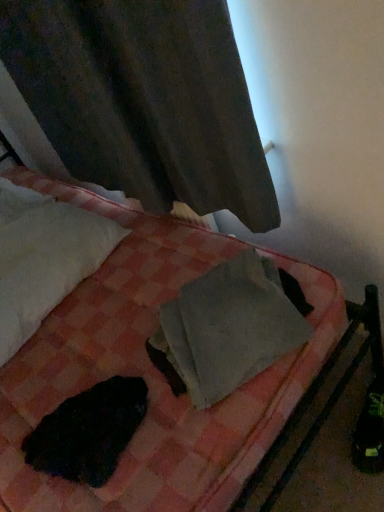
This screenshot has height=512, width=384. What do you see at coordinates (144, 100) in the screenshot? I see `matte gray curtain at upper left` at bounding box center [144, 100].

At what (x,y) coordinates should I click in order to perform the action: click on black fur at lower left. Please return your answer as a coordinate pair (x, y). This screenshot has height=512, width=384. Looking at the image, I should click on (88, 432).

In order to face white soft pillow at upper left, should I rotate leftwards or rightwards?

It's best to rotate left around 22.054 degrees.

The height and width of the screenshot is (512, 384). I want to click on pink checkered blanket at center, so click(158, 372).

Looking at this image, measure the distance between pink checkered blanket at center and camera.

pink checkered blanket at center is 32.79 inches away from camera.

This screenshot has height=512, width=384. What are the coordinates of `matte gray curtain at upper left` in the screenshot? It's located at (144, 100).

From the image's perspective, which is above, matte gray curtain at upper left or gray matte paper at center?

From the image's view, matte gray curtain at upper left is above.

Does matte gray curtain at upper left have a lesser width compared to gray matte paper at center?

Yes, matte gray curtain at upper left is thinner than gray matte paper at center.

From a real-world perspective, between matte gray curtain at upper left and gray matte paper at center, who is vertically higher?

matte gray curtain at upper left.

Relative to gray matte paper at center, is matte gray curtain at upper left in front or behind?

Clearly, matte gray curtain at upper left is in front of gray matte paper at center.

Can you confirm if black fur at lower left is smaller than pink checkered blanket at center?

Yes, black fur at lower left is smaller than pink checkered blanket at center.

From a real-world perspective, is black fur at lower left physically above pink checkered blanket at center?

No, from a real-world perspective, black fur at lower left is not over pink checkered blanket at center

Is the depth of black fur at lower left less than that of pink checkered blanket at center?

No, it is behind pink checkered blanket at center.

Which is behind, point (35, 470) or point (19, 385)?

Positioned behind is point (19, 385).

Which point is more distant from viewer, [215,398] or [29,496]?

Positioned behind is point [215,398].

Is pink checkered blanket at center located within gray matte paper at center?

No, pink checkered blanket at center is not a part of gray matte paper at center.

From a real-world perspective, is gray matte paper at center over pink checkered blanket at center?

No, from a real-world perspective, gray matte paper at center is not over pink checkered blanket at center

Which of these two, gray matte paper at center or pink checkered blanket at center, is smaller?

gray matte paper at center.

Who is shorter, gray matte paper at center or matte gray curtain at upper left?

Standing shorter between the two is gray matte paper at center.

Consider the image. From a real-world perspective, is gray matte paper at center located higher than matte gray curtain at upper left?

No, from a real-world perspective, gray matte paper at center is not over matte gray curtain at upper left

Is gray matte paper at center looking in the opposite direction of matte gray curtain at upper left?

That's right, gray matte paper at center is facing away from matte gray curtain at upper left.

Is gray matte paper at center positioned beyond the bounds of matte gray curtain at upper left?

Yes, gray matte paper at center is located beyond the bounds of matte gray curtain at upper left.

Can we say pink checkered blanket at center lies outside white soft pillow at upper left?

Yes, pink checkered blanket at center is outside of white soft pillow at upper left.

Can you tell me how much pink checkered blanket at center and white soft pillow at upper left differ in facing direction?

The angle between the facing direction of pink checkered blanket at center and the facing direction of white soft pillow at upper left is 4.01 degrees.

Could you tell me if pink checkered blanket at center is facing white soft pillow at upper left?

Yes, pink checkered blanket at center is aimed at white soft pillow at upper left.

From the image's perspective, who appears lower, pink checkered blanket at center or white soft pillow at upper left?

From the image's view, pink checkered blanket at center is below.

Which object is thinner, pink checkered blanket at center or gray matte paper at center?

Thinner between the two is gray matte paper at center.

Considering the sizes of objects pink checkered blanket at center and gray matte paper at center in the image provided, who is taller, pink checkered blanket at center or gray matte paper at center?

With more height is pink checkered blanket at center.

Is point (205, 268) positioned after point (211, 354)?

That is True.

Is black fur at lower left far from matte gray curtain at upper left?

No.

Is black fur at lower left shorter than matte gray curtain at upper left?

Yes, black fur at lower left is shorter than matte gray curtain at upper left.

From a real-world perspective, is black fur at lower left physically located above or below matte gray curtain at upper left?

black fur at lower left is situated lower than matte gray curtain at upper left in the real world.

Who is smaller, black fur at lower left or matte gray curtain at upper left?

With smaller size is black fur at lower left.

The image size is (384, 512). I want to click on curtain in front of the gray matte paper at center, so click(144, 100).

Locate an element on the screen. bed above the black fur at lower left (from a real-world perspective) is located at coordinates (158, 372).

Consider the image. Estimate the real-world distances between objects in this image. Which object is further from black fur at lower left, pink checkered blanket at center or white soft pillow at upper left?

Among the two, white soft pillow at upper left is located further to black fur at lower left.

In the scene shown: When comparing their distances from gray matte paper at center, does black fur at lower left or white soft pillow at upper left seem closer?

The object closer to gray matte paper at center is black fur at lower left.

Considering their positions, is gray matte paper at center positioned closer to pink checkered blanket at center than black fur at lower left?

Based on the image, gray matte paper at center appears to be nearer to pink checkered blanket at center.

Looking at this image, looking at the image, which one is located further to gray matte paper at center, black fur at lower left or matte gray curtain at upper left?

The object further to gray matte paper at center is matte gray curtain at upper left.

From the image, which object appears to be farther from pink checkered blanket at center, gray matte paper at center or white soft pillow at upper left?

white soft pillow at upper left is further to pink checkered blanket at center.

From the image, which object appears to be farther from white soft pillow at upper left, gray matte paper at center or matte gray curtain at upper left?

gray matte paper at center lies further to white soft pillow at upper left than the other object.

Estimate the real-world distances between objects in this image. Which object is closer to pink checkered blanket at center, black fur at lower left or matte gray curtain at upper left?

Based on the image, black fur at lower left appears to be nearer to pink checkered blanket at center.

From the image, which object appears to be nearer to matte gray curtain at upper left, black fur at lower left or pink checkered blanket at center?

Based on the image, pink checkered blanket at center appears to be nearer to matte gray curtain at upper left.

You are a GUI agent. You are given a task and a screenshot of the screen. Output one action in this format:
    pyautogui.click(x=<x>, y=<y>)
    Task: Click on the animal between pink checkered blanket at center and white soft pillow at upper left in the front-back direction
    
    Given the screenshot: What is the action you would take?
    pyautogui.click(x=88, y=432)

Find the location of `curtain between pink checkered blanket at center and gray matte paper at center in the horizontal direction`. curtain between pink checkered blanket at center and gray matte paper at center in the horizontal direction is located at coordinates (144, 100).

You are a GUI agent. You are given a task and a screenshot of the screen. Output one action in this format:
    pyautogui.click(x=<x>, y=<y>)
    Task: Click on the pillow that lies between matte gray curtain at upper left and black fur at lower left from top to bottom
    
    Given the screenshot: What is the action you would take?
    pyautogui.click(x=44, y=258)

Find the location of `animal located between pink checkered blanket at center and gray matte paper at center in the depth direction`. animal located between pink checkered blanket at center and gray matte paper at center in the depth direction is located at coordinates 88,432.